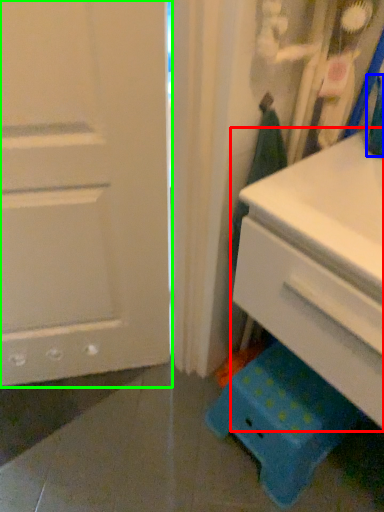
Question: Estimate the real-world distances between objects in this image. Which object is closer to chest of drawers (highlighted by a red box), teal (highlighted by a blue box) or door (highlighted by a green box)?

Choices:
 (A) teal
 (B) door

Answer: (A)